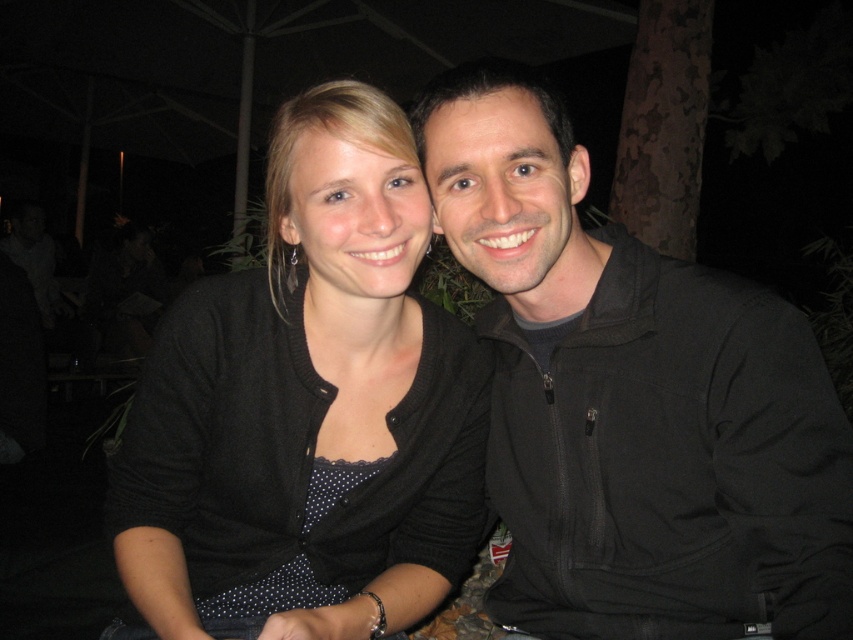
Question: Is black softshell jacket at right below black matte cardigan at center?

Choices:
 (A) yes
 (B) no

Answer: (B)

Question: Is black softshell jacket at right above black matte cardigan at center?

Choices:
 (A) no
 (B) yes

Answer: (B)

Question: Can you confirm if black softshell jacket at right is wider than black matte cardigan at center?

Choices:
 (A) no
 (B) yes

Answer: (A)

Question: Which point is closer to the camera?

Choices:
 (A) black matte cardigan at center
 (B) black softshell jacket at right

Answer: (B)